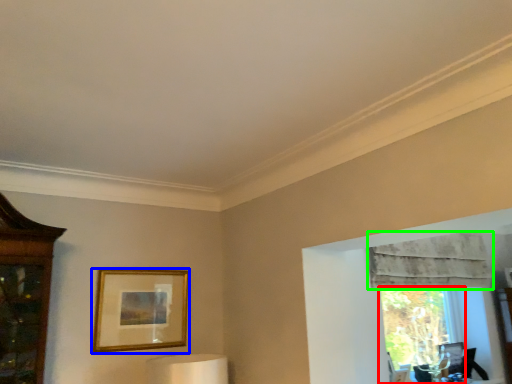
Question: Considering the real-world distances, which object is farthest from window (highlighted by a red box)? picture frame (highlighted by a blue box) or curtain (highlighted by a green box)?

Choices:
 (A) picture frame
 (B) curtain

Answer: (A)